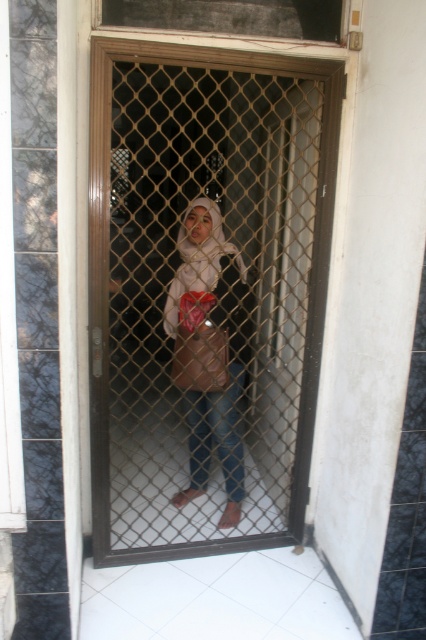
Is metal mesh door at center positioned at the back of matte beige hijab at center?

That is False.

Between metal mesh door at center and matte beige hijab at center, which one is positioned higher?

metal mesh door at center is higher up.

This screenshot has width=426, height=640. Describe the element at coordinates (206, 292) in the screenshot. I see `metal mesh door at center` at that location.

You are a GUI agent. You are given a task and a screenshot of the screen. Output one action in this format:
    pyautogui.click(x=<x>, y=<y>)
    Task: Click on the metal mesh door at center
    The width and height of the screenshot is (426, 640).
    Given the screenshot: What is the action you would take?
    pyautogui.click(x=206, y=292)